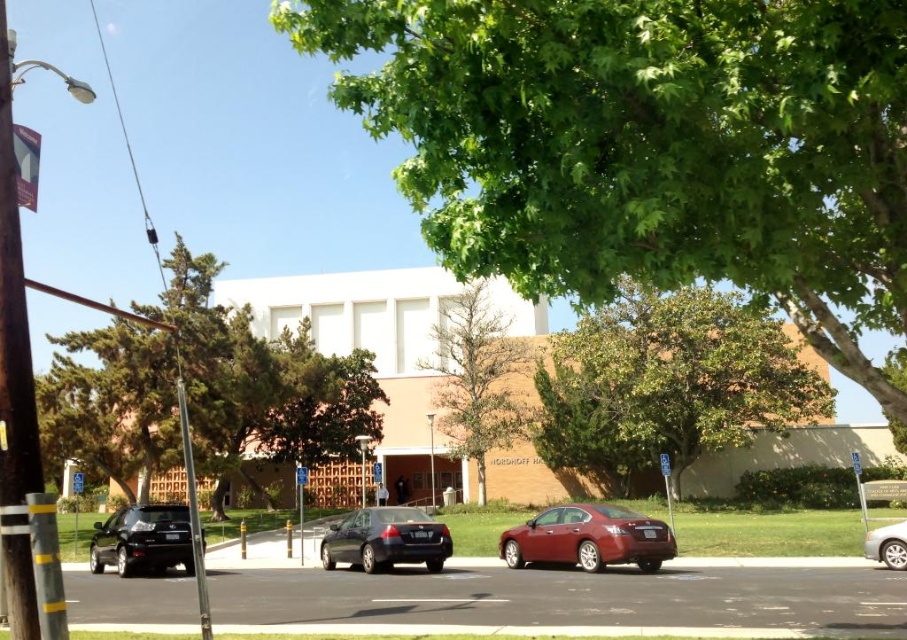
You are a landscape architect designing a new garden. You need to place a new bench between the green leafy tree at upper center and the silver metallic sedan at lower right. Considering their widths, which object should the bench be closer to to ensure it doesn

The bench should be placed closer to the silver metallic sedan at lower right because the green leafy tree at upper center is wider than the silver metallic sedan at lower right, so positioning the bench near the narrower object allows more space around the wider tree.

You are a delivery person trying to park your vehicle, which is 5 meters long, in the parking area near the silver metallic sedan at lower right. The green leafy tree at upper center is blocking part of the parking spot. Can you fit your vehicle there without hitting the tree?

The green leafy tree at upper center is larger in size than the silver metallic sedan at lower right, but the vehicle is 5 meters long. Since the tree is blocking part of the parking spot, it might not be possible to park the 5 meter long vehicle there without hitting the tree. Check the available space carefully before attempting to park.

You are a gardener who needs to water both the green leafy tree at center and the brown textured tree at center. Which tree requires more water due to its size?

The green leafy tree at center requires more water because it is larger in size than the brown textured tree at center.